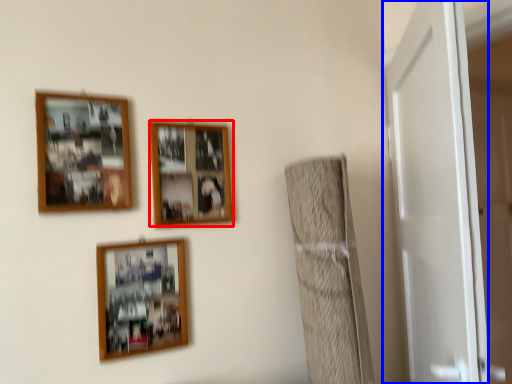
Question: Among these objects, which one is farthest to the camera, picture frame (highlighted by a red box) or door (highlighted by a blue box)?

Choices:
 (A) picture frame
 (B) door

Answer: (A)